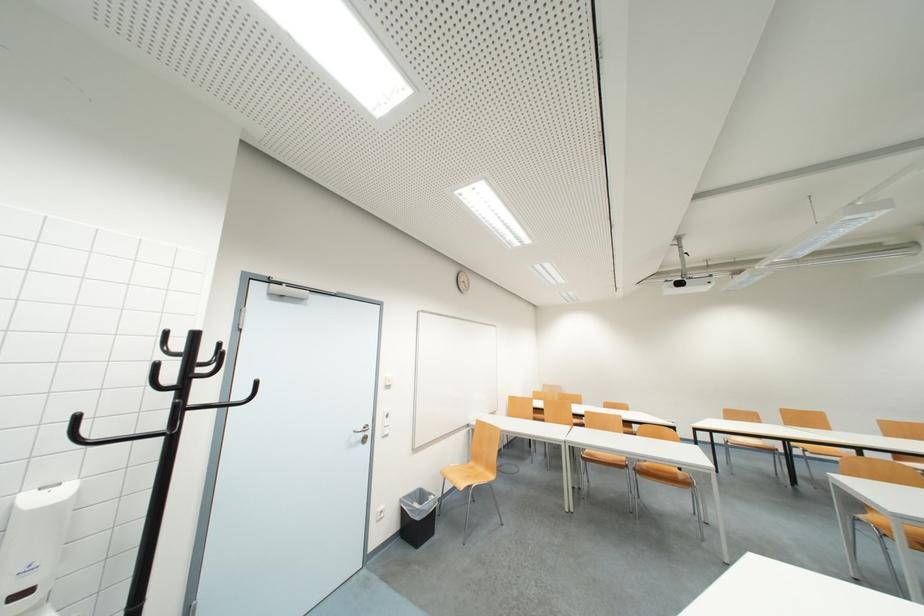
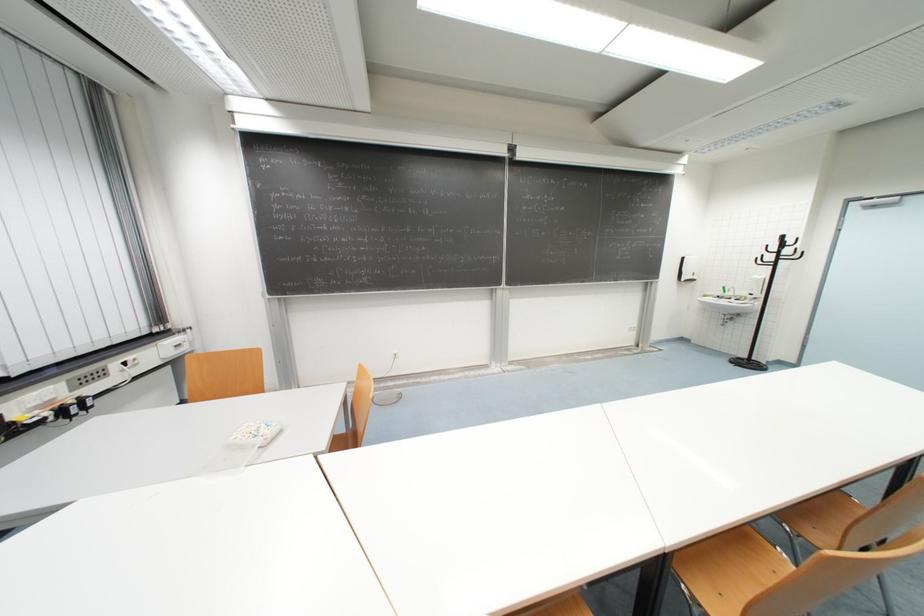
The point at (x=176, y=379) is marked in the first image. Where is the corresponding point in the second image?

(779, 251)